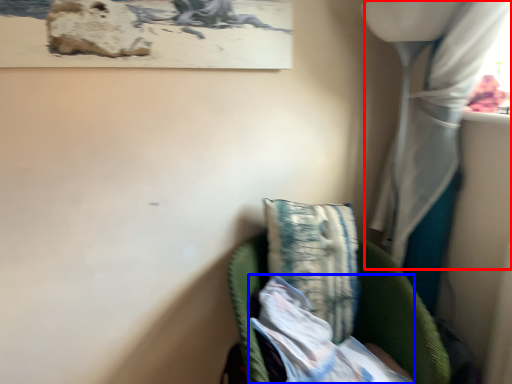
Question: Which object appears closest to the camera in this image, curtain (highlighted by a red box) or wrapping paper (highlighted by a blue box)?

Choices:
 (A) curtain
 (B) wrapping paper

Answer: (A)